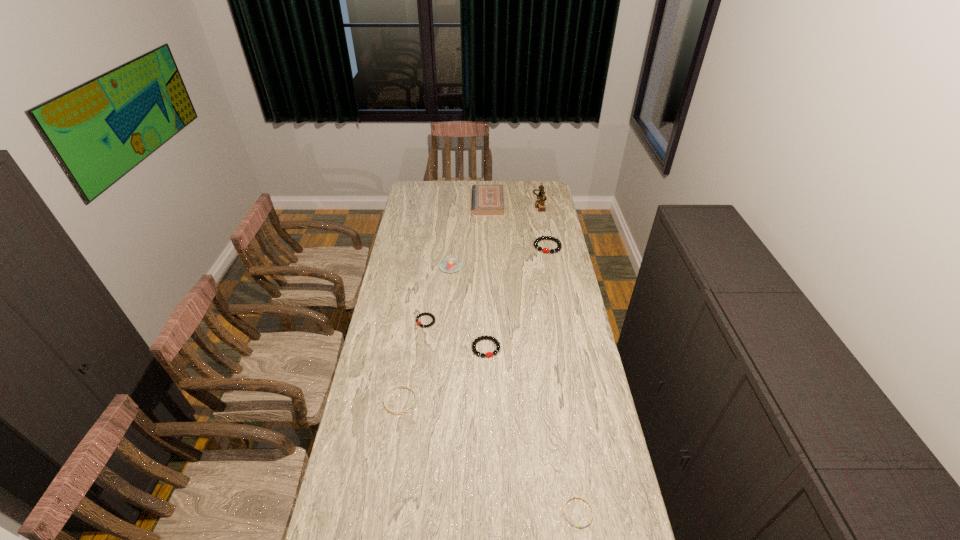
Where is `the farther blue bracelet`? The height and width of the screenshot is (540, 960). the farther blue bracelet is located at coordinates (390, 390).

This screenshot has width=960, height=540. In order to click on the fourth farthest bracelet in this screenshot , I will do `click(390, 390)`.

Identify the location of the leftmost black bracelet. (425, 313).

This screenshot has width=960, height=540. In order to click on the fourth nearest bracelet in this screenshot , I will do `click(425, 313)`.

At what (x,y) coordinates should I click in order to perform the action: click on the smaller blue bracelet. Please return your answer as a coordinate pair (x, y). Image resolution: width=960 pixels, height=540 pixels. Looking at the image, I should click on (570, 498).

In order to click on the nearest object in this screenshot , I will do `click(570, 498)`.

Find the location of a particular element. blank space located 0.300m on the front-facing side of the tallest object is located at coordinates (484, 202).

Locate an element on the screen. free region located on the front-facing side of the tallest object is located at coordinates (513, 202).

Locate an element on the screen. This screenshot has height=540, width=960. free space located 0.380m on the front-facing side of the tallest object is located at coordinates (470, 202).

This screenshot has width=960, height=540. What are the coordinates of `vacant point located on the spine side of the Bible` in the screenshot? It's located at (452, 203).